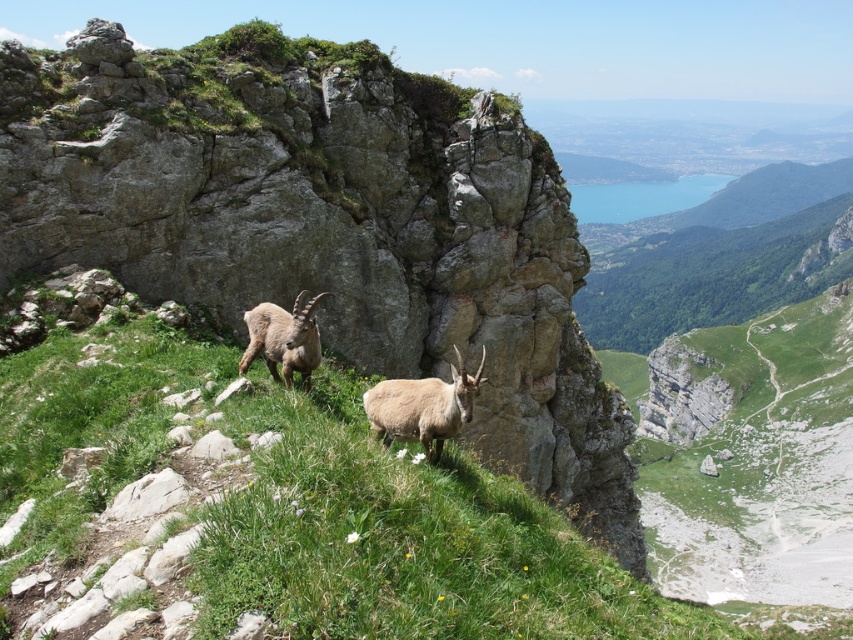
Question: Is the position of light brown woolen ram at center more distant than that of light brown woolen goat at center?

Choices:
 (A) no
 (B) yes

Answer: (A)

Question: Which point is farther to the camera?

Choices:
 (A) (276, 360)
 (B) (425, 390)

Answer: (A)

Question: Is light brown woolen ram at center to the left of light brown woolen goat at center from the viewer's perspective?

Choices:
 (A) no
 (B) yes

Answer: (A)

Question: Among these points, which one is nearest to the camera?

Choices:
 (A) (428, 410)
 (B) (297, 326)

Answer: (A)

Question: Which point is closer to the camera?

Choices:
 (A) light brown woolen ram at center
 (B) light brown woolen goat at center

Answer: (A)

Question: Considering the relative positions of light brown woolen ram at center and light brown woolen goat at center in the image provided, where is light brown woolen ram at center located with respect to light brown woolen goat at center?

Choices:
 (A) left
 (B) right

Answer: (B)